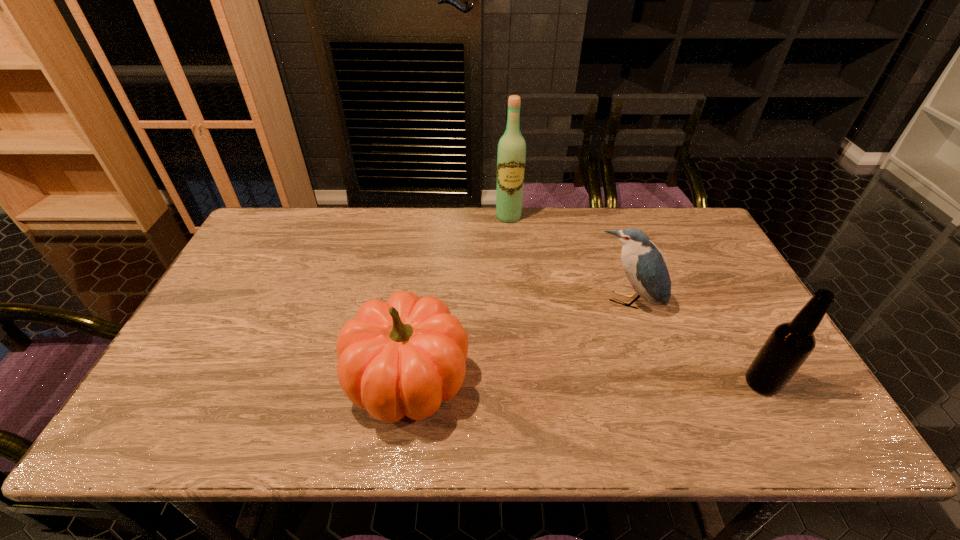
You are a GUI agent. You are given a task and a screenshot of the screen. Output one action in this format:
    pyautogui.click(x=<x>, y=<y>)
    Task: Click on the free space located at the tip of the third object from left to right's beak
    The image size is (960, 540).
    Given the screenshot: What is the action you would take?
    pyautogui.click(x=596, y=377)

Where is `vacant space located on the front-facing side of the tallest object`? vacant space located on the front-facing side of the tallest object is located at coordinates (511, 233).

The image size is (960, 540). I want to click on free location located on the front-facing side of the tallest object, so click(x=512, y=240).

At what (x,y) coordinates should I click in order to perform the action: click on vacant space positioned 0.190m on the front-facing side of the tallest object. Please return your answer as a coordinate pair (x, y). Looking at the image, I should click on (516, 260).

Where is `object at the far edge`? The width and height of the screenshot is (960, 540). object at the far edge is located at coordinates (511, 156).

At what (x,y) coordinates should I click in order to perform the action: click on pumpkin present at the near edge. Please return your answer as a coordinate pair (x, y). Image resolution: width=960 pixels, height=540 pixels. Looking at the image, I should click on (403, 357).

At what (x,y) coordinates should I click in order to perform the action: click on beer bottle that is at the near edge. Please return your answer as a coordinate pair (x, y). Looking at the image, I should click on (789, 345).

Where is `object at the right edge`? object at the right edge is located at coordinates (789, 345).

Locate an element on the screen. This screenshot has width=960, height=540. object at the near right corner is located at coordinates (789, 345).

In the image, there is a desktop. Where is `vacant space at the far edge`? This screenshot has height=540, width=960. vacant space at the far edge is located at coordinates (592, 228).